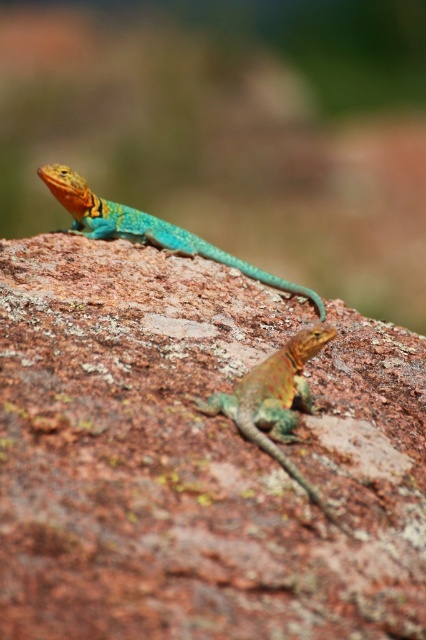
From the picture: Between shiny green lizard at center and shiny turquoise lizard at upper center, which one is positioned lower?

shiny green lizard at center

Does shiny green lizard at center appear under shiny turquoise lizard at upper center?

Indeed, shiny green lizard at center is positioned under shiny turquoise lizard at upper center.

What are the coordinates of `shiny green lizard at center` in the screenshot? It's located at (275, 401).

Is rusty rock at center further to camera compared to shiny turquoise lizard at upper center?

No, it is in front of shiny turquoise lizard at upper center.

Can you confirm if rusty rock at center is positioned to the left of shiny turquoise lizard at upper center?

No, rusty rock at center is not to the left of shiny turquoise lizard at upper center.

Who is more forward, (275, 568) or (190, 250)?

Positioned in front is point (275, 568).

At what (x,y) coordinates should I click in order to perform the action: click on rusty rock at center. Please return your answer as a coordinate pair (x, y). Looking at the image, I should click on (195, 458).

Between point (181, 266) and point (256, 406), which one is positioned in front?

Positioned in front is point (256, 406).

Is point (89, 458) closer to viewer compared to point (226, 410)?

Yes, it is.

Locate an element on the screen. rusty rock at center is located at coordinates (195, 458).